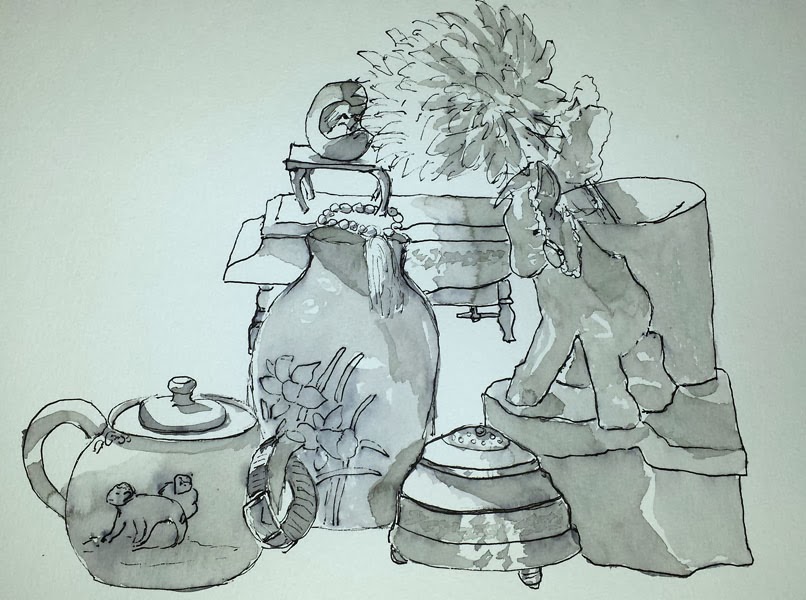
Find the location of a particular element. Image resolution: width=806 pixels, height=600 pixels. teapot is located at coordinates (219, 483).